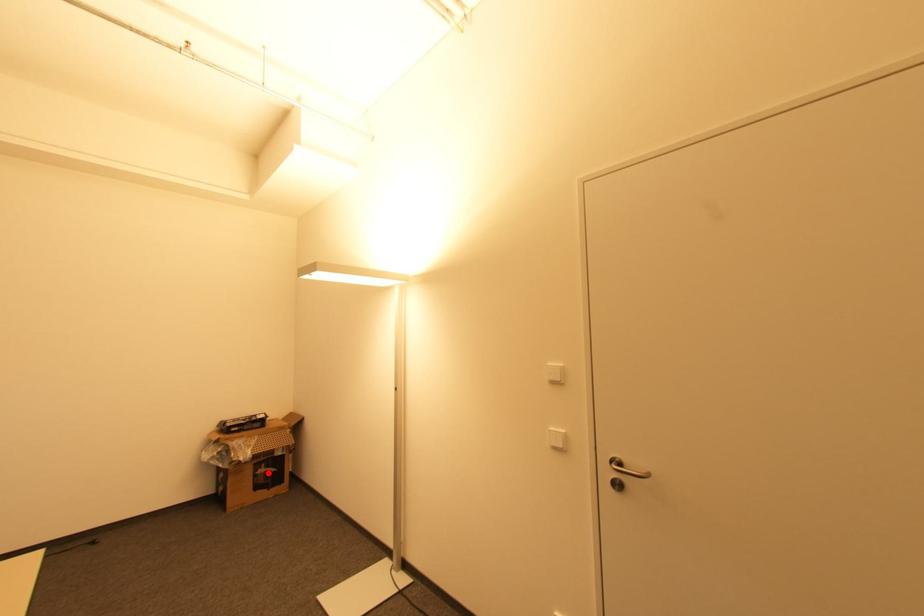
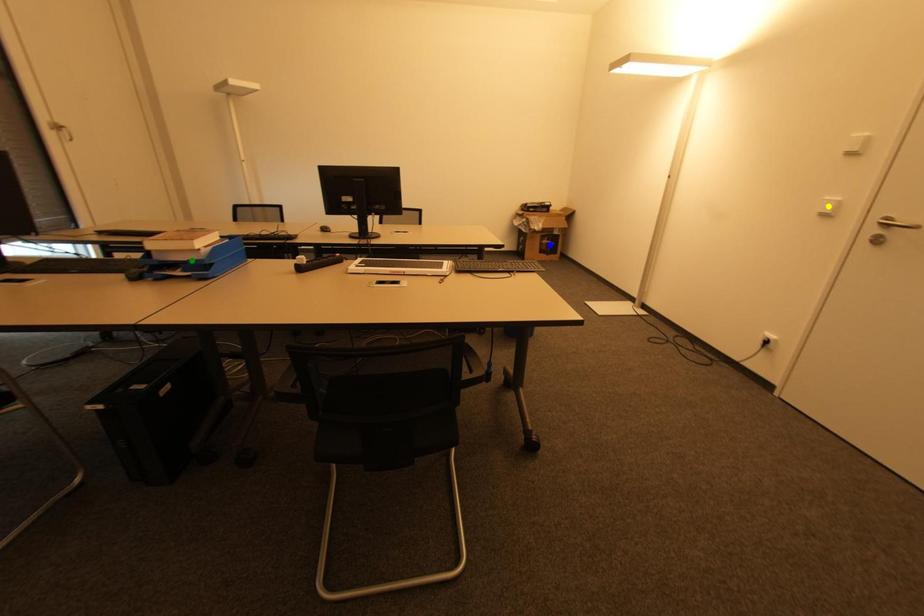
Question: I am providing you with two images of the same scene from different viewpoints. A red point is marked on the first image. You are given multiple points on the second image. Which mark in image 2 goes with the point in image 1?

Choices:
 (A) green point
 (B) yellow point
 (C) blue point

Answer: (C)